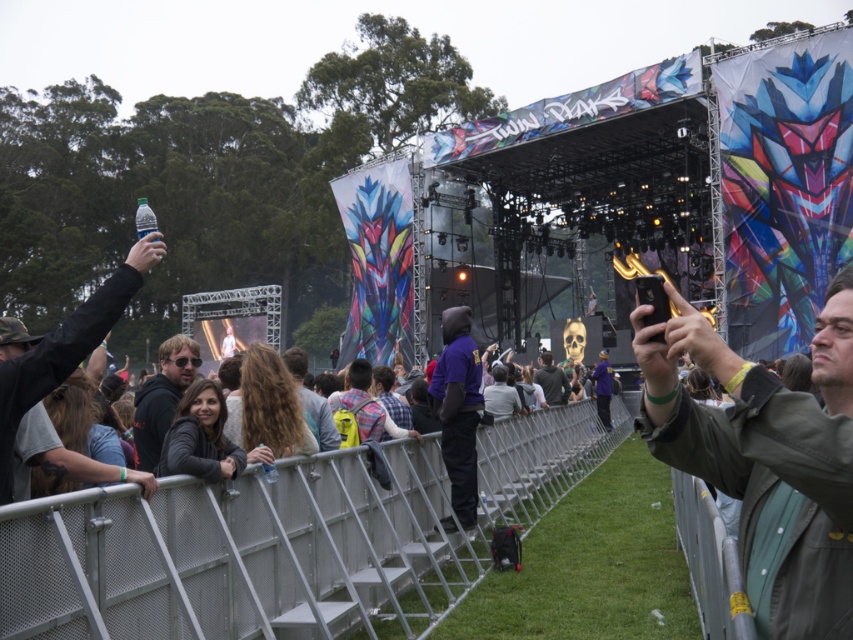
What are the coordinates of the matte black jacket at center?

The matte black jacket at center is located at point (161, 397).

You are standing at the point labeled as point (155,442) and want to move to the stage area. There is a barrier at point (71,477). Can you walk directly towards the stage without passing through the barrier?

Point (71,477) is in front of point (155,442), so the barrier at point (71,477) is closer to the stage. Therefore, you would need to go around the barrier at point (71,477) to reach the stage area without passing through it.

You are standing at the center of the stage and want to hand a matte black jacket to the lead singer who is at the point marked as point (161, 397). In which direction should you move to reach that point?

The point (161, 397) is at center, so you don not need to move any direction. You are already at the center.